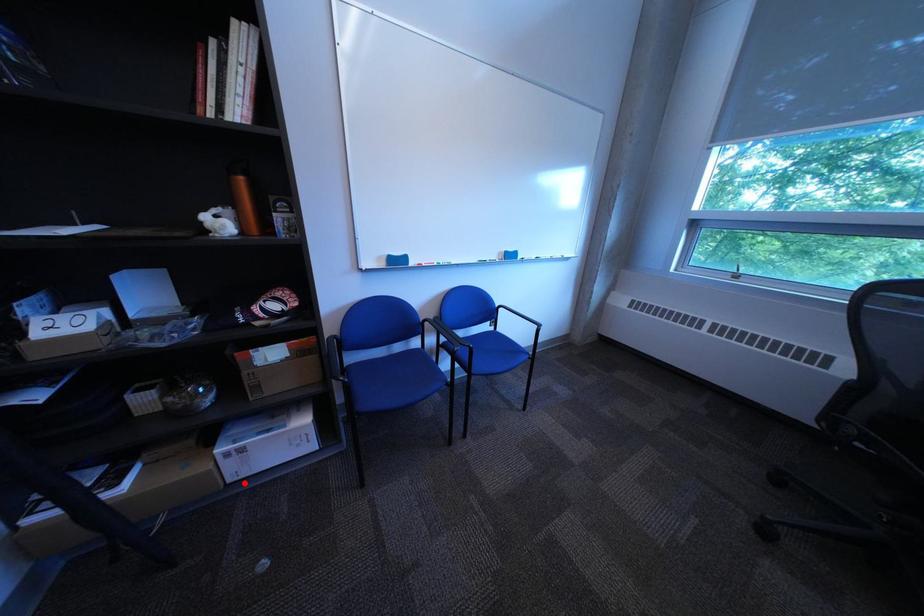
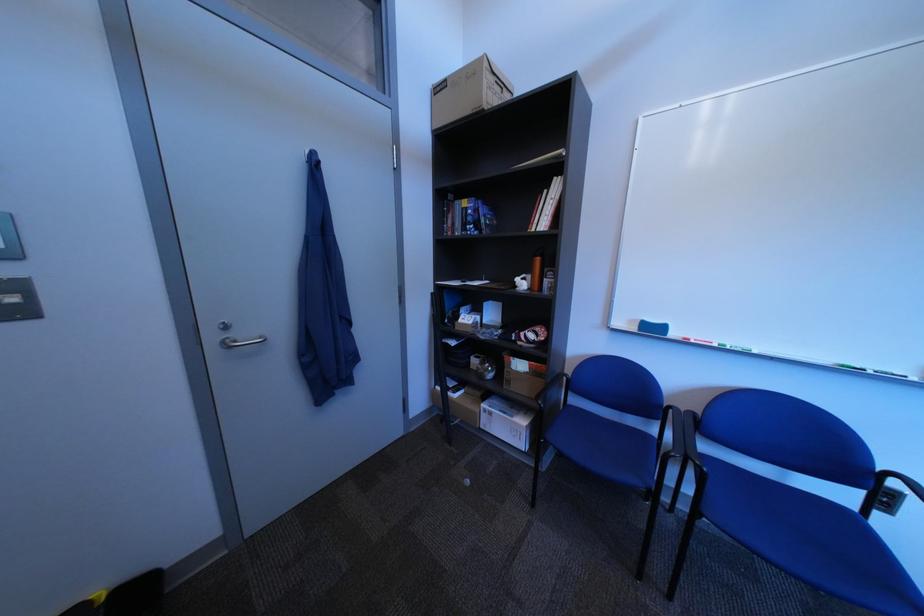
In the second image, find the point that corresponds to the highlighted location in the first image.

(496, 429)